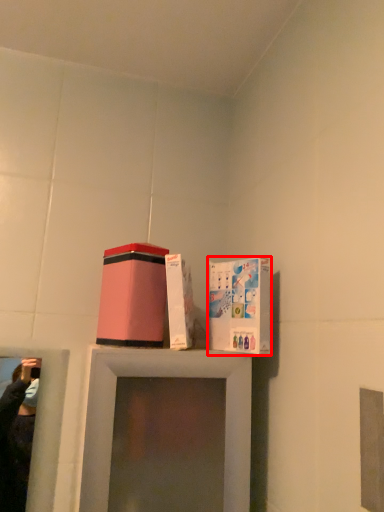
Question: From the image's perspective, what is the correct spatial relationship of cardboard box (annotated by the red box) in relation to box?

Choices:
 (A) above
 (B) below

Answer: (B)